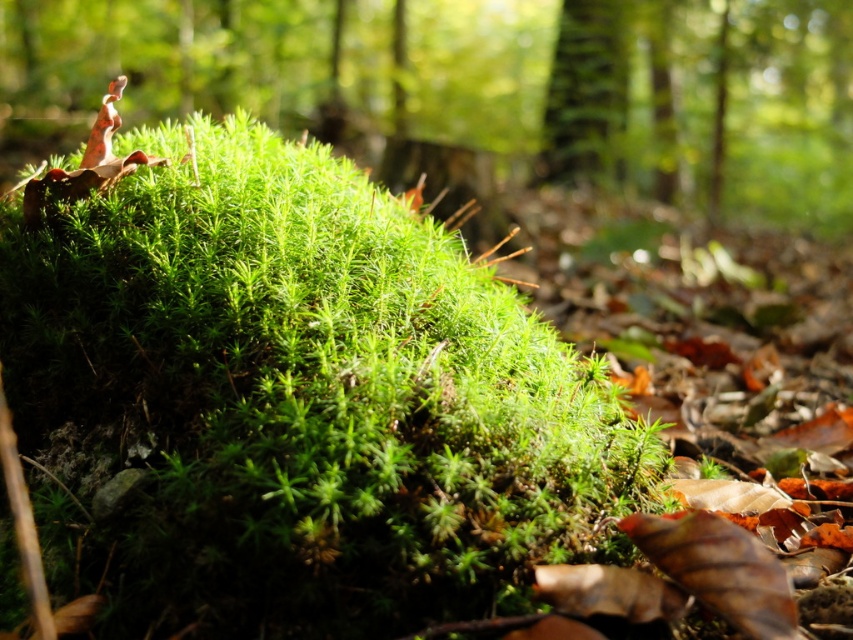
Question: Which point appears closest to the camera in this image?

Choices:
 (A) (544, 122)
 (B) (300, 40)

Answer: (A)

Question: Can you confirm if green fuzzy moss at center is positioned below green textured bark at upper center?

Choices:
 (A) no
 (B) yes

Answer: (A)

Question: Can you confirm if green fuzzy moss at center is smaller than green textured bark at upper center?

Choices:
 (A) no
 (B) yes

Answer: (A)

Question: Is green fuzzy moss at center positioned in front of green textured bark at upper center?

Choices:
 (A) yes
 (B) no

Answer: (A)